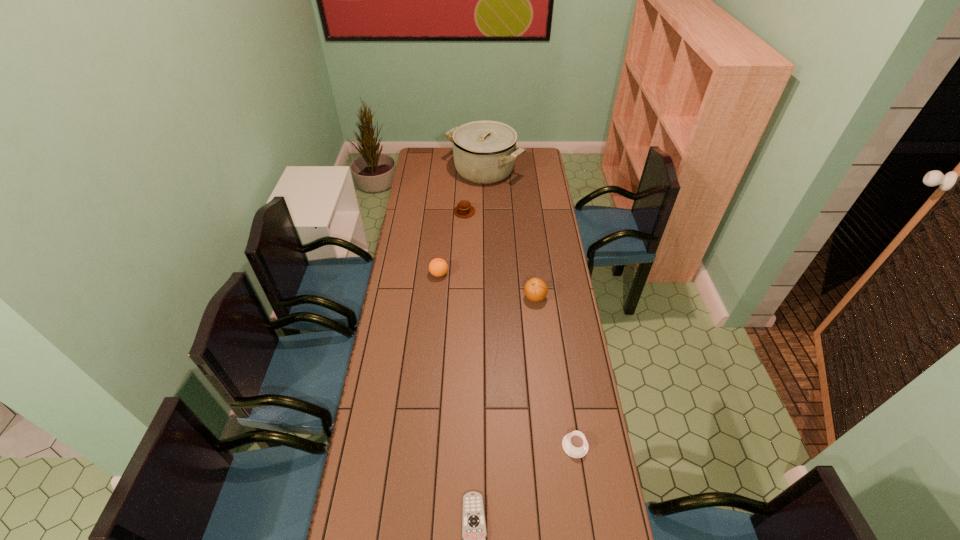
Identify the location of the farthest object. Image resolution: width=960 pixels, height=540 pixels. (484, 152).

Locate an element on the screen. The width and height of the screenshot is (960, 540). saucepan is located at coordinates (484, 152).

Locate an element on the screen. the taller orange is located at coordinates click(535, 289).

Locate an element on the screen. the fifth shortest object is located at coordinates (535, 289).

At what (x,y) coordinates should I click in order to perform the action: click on the farther orange. Please return your answer as a coordinate pair (x, y). The width and height of the screenshot is (960, 540). Looking at the image, I should click on point(438,267).

Identify the location of the shorter orange. The width and height of the screenshot is (960, 540). (438, 267).

The height and width of the screenshot is (540, 960). I want to click on muffin, so click(x=464, y=209).

Identify the location of the third shortest object. (464, 209).

Where is `teacup`? teacup is located at coordinates (574, 444).

Find the location of a particular element. the second shortest object is located at coordinates (574, 444).